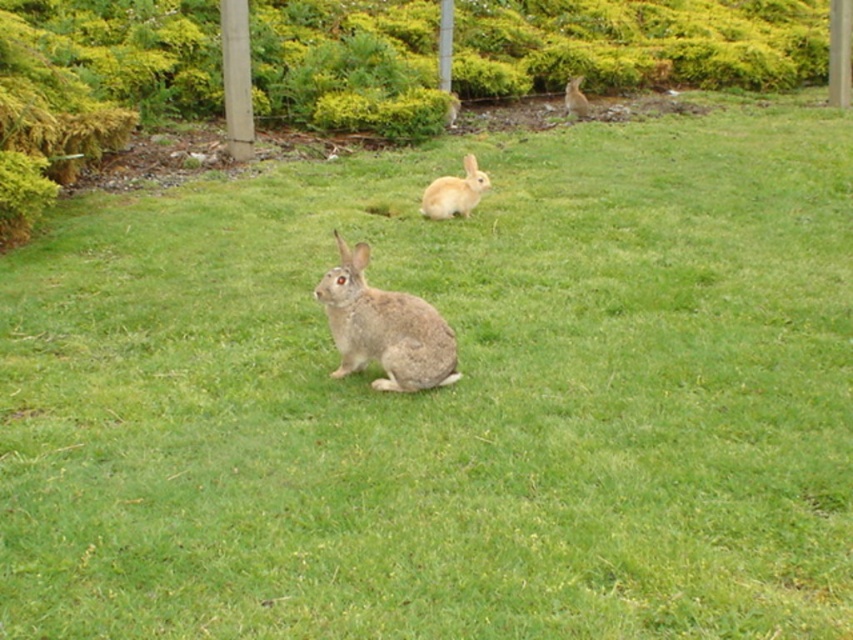
Who is positioned more to the left, fuzzy gray rabbit at center or fuzzy brown rabbit at center?

fuzzy gray rabbit at center

Which is behind, point (453, 348) or point (422, 196)?

The point (422, 196) is more distant.

Where is `fuzzy gray rabbit at center`? fuzzy gray rabbit at center is located at coordinates (384, 326).

Does fuzzy gray rabbit at center have a greater width compared to fuzzy brown rabbit at upper center?

Yes.

Is point (355, 248) farther from viewer compared to point (578, 86)?

No, it is not.

This screenshot has height=640, width=853. I want to click on fuzzy gray rabbit at center, so click(384, 326).

Does fuzzy brown rabbit at center have a larger size compared to fuzzy brown rabbit at upper center?

No.

Is fuzzy brown rabbit at center positioned behind fuzzy brown rabbit at upper center?

No, it is in front of fuzzy brown rabbit at upper center.

The height and width of the screenshot is (640, 853). What do you see at coordinates (454, 192) in the screenshot?
I see `fuzzy brown rabbit at center` at bounding box center [454, 192].

Identify the location of fuzzy brown rabbit at center. (454, 192).